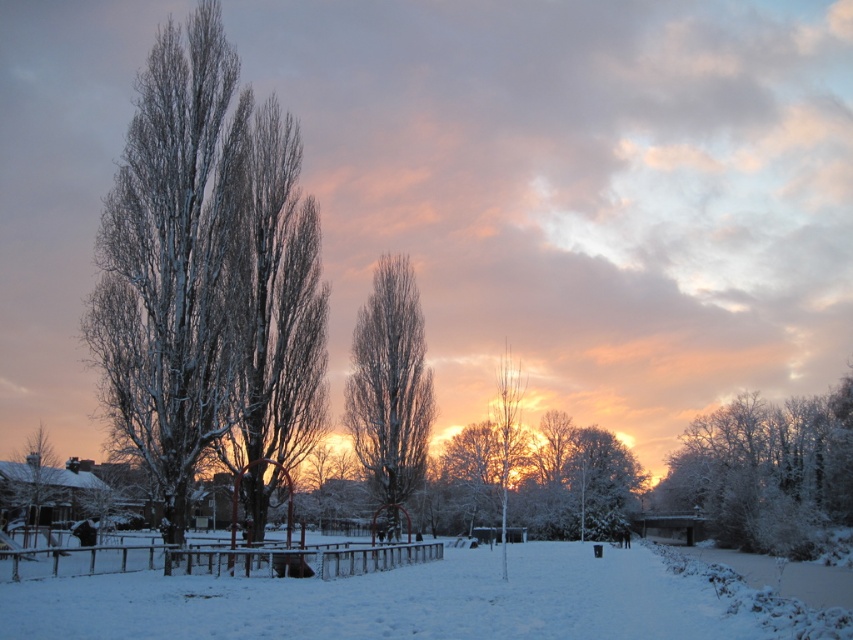
Question: Does white frosty trees at right have a greater width compared to white smooth tree at center?

Choices:
 (A) no
 (B) yes

Answer: (B)

Question: Does snow-covered tree at center appear over white snow-covered tree at center?

Choices:
 (A) yes
 (B) no

Answer: (A)

Question: Does white snow-covered tree at center appear on the right side of white snow-covered tree at left?

Choices:
 (A) no
 (B) yes

Answer: (B)

Question: Among these points, which one is farthest from the camera?

Choices:
 (A) (567, 480)
 (B) (722, 442)

Answer: (A)

Question: Which of these objects is positioned farthest from the white fluffy snow at center?

Choices:
 (A) white smooth tree at center
 (B) metallic silver fence at lower center

Answer: (A)

Question: Which of the following is the farthest from the observer?

Choices:
 (A) white snow-covered tree at center
 (B) white frosty trees at right
 (C) metallic silver fence at lower center

Answer: (A)